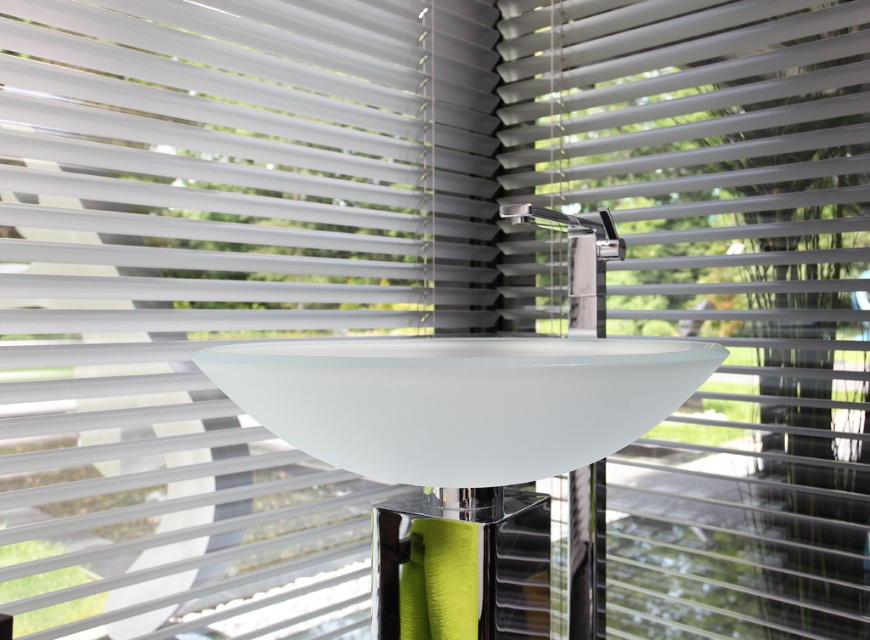
Question: From the image, what is the correct spatial relationship of white matte blind at center in relation to frosted glass sink at center?

Choices:
 (A) above
 (B) below

Answer: (A)

Question: In this image, where is white matte blind at center located relative to polished chrome faucet at center?

Choices:
 (A) left
 (B) right

Answer: (B)

Question: Which point is farther to the camera?

Choices:
 (A) (580, 246)
 (B) (299, 369)

Answer: (A)

Question: Which object is farther from the camera taking this photo?

Choices:
 (A) polished chrome faucet at center
 (B) white matte blind at center
 (C) frosted glass sink at center

Answer: (B)

Question: Estimate the real-world distances between objects in this image. Which object is farther from the frosted glass sink at center?

Choices:
 (A) white matte blind at center
 (B) polished chrome faucet at center

Answer: (A)

Question: Can you confirm if white matte blind at center is thinner than frosted glass sink at center?

Choices:
 (A) no
 (B) yes

Answer: (A)